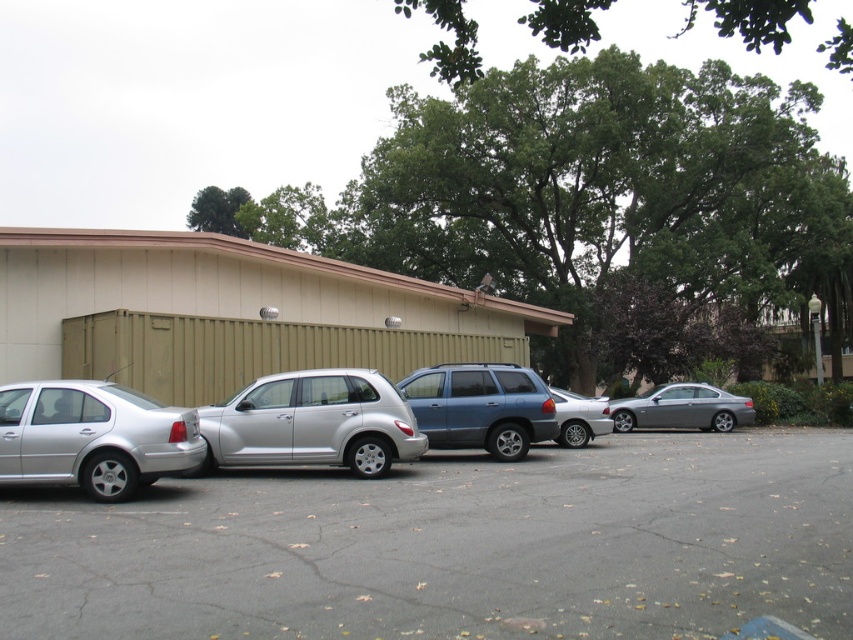
You are a parking attendant trying to fit a new car into the parking spot between the silver metallic sedan at left and the silver metallic sedan at center. Based on their widths, can you determine if there is enough space for the new car if the space between them is 2 meters wide?

The silver metallic sedan at left might be wider than silver metallic sedan at center. However, without exact width measurements, it is uncertain whether the combined width of both vehicles would leave sufficient space for the new car in the 2 meter gap. Please measure the actual widths before deciding.

Consider the image. You are standing at the point marked by coordinates point (312, 422) in the parking lot. What vehicle are you standing on?

The point (312, 422) marks the silver metallic hatchback at center, so you are standing on the silver metallic hatchback at center.